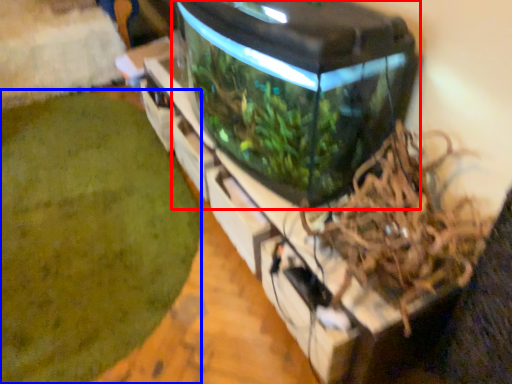
Question: Which object appears closest to the camera in this image, water tank (highlighted by a red box) or debris (highlighted by a blue box)?

Choices:
 (A) water tank
 (B) debris

Answer: (A)